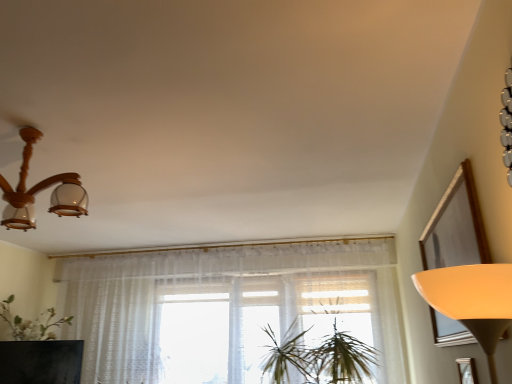
Locate an element on the screen. The width and height of the screenshot is (512, 384). wooden picture frame at lower right is located at coordinates (467, 370).

The height and width of the screenshot is (384, 512). What are the coordinates of `wooden chandelier at upper left` in the screenshot? It's located at (40, 190).

What do you see at coordinates (226, 308) in the screenshot? I see `sheer white curtain at center` at bounding box center [226, 308].

Describe the element at coordinates (41, 362) in the screenshot. The width and height of the screenshot is (512, 384). I see `matte black tv at lower left` at that location.

Identify the location of wooden picture frame at lower right. (467, 370).

Who is shorter, matte black tv at lower left or sheer white curtain at center?

matte black tv at lower left.

From the image's perspective, who appears lower, matte black tv at lower left or sheer white curtain at center?

matte black tv at lower left appears lower in the image.

From a real-world perspective, which object stands above the other?

sheer white curtain at center, from a real-world perspective.

In the scene shown: Looking at the image, does matte black tv at lower left seem bigger or smaller compared to sheer white curtain at center?

Clearly, matte black tv at lower left is smaller in size than sheer white curtain at center.

Is green leafy plant at center facing towards wooden chandelier at upper left?

No, green leafy plant at center is not facing towards wooden chandelier at upper left.

Is green leafy plant at center smaller than wooden chandelier at upper left?

Actually, green leafy plant at center might be larger than wooden chandelier at upper left.

Between green leafy plant at center and wooden chandelier at upper left, which one is positioned in front?

wooden chandelier at upper left is closer to the camera.

Image resolution: width=512 pixels, height=384 pixels. There is a green leafy plant at center. What are the coordinates of `curtain above it (from a real-world perspective)` in the screenshot? It's located at (226, 308).

Is green leafy plant at center positioned far away from sheer white curtain at center?

No.

From the image's perspective, is green leafy plant at center on sheer white curtain at center?

Indeed, from the image's perspective, green leafy plant at center is shown above sheer white curtain at center.

Can you confirm if green leafy plant at center is wider than sheer white curtain at center?

Yes, green leafy plant at center is wider than sheer white curtain at center.

Could matte black tv at lower left be considered to be inside wooden chandelier at upper left?

No, wooden chandelier at upper left does not contain matte black tv at lower left.

Which is in front, wooden chandelier at upper left or matte black tv at lower left?

Positioned in front is wooden chandelier at upper left.

Is sheer white curtain at center looking in the opposite direction of wooden chandelier at upper left?

No.

Is sheer white curtain at center placed right next to wooden chandelier at upper left?

No, sheer white curtain at center is not beside wooden chandelier at upper left.

From the picture: Is sheer white curtain at center not inside wooden chandelier at upper left?

sheer white curtain at center is positioned outside wooden chandelier at upper left.

Which of these two, sheer white curtain at center or wooden chandelier at upper left, is smaller?

wooden chandelier at upper left.

From the picture: Is wooden chandelier at upper left with green leafy plant at center?

No, wooden chandelier at upper left is not with green leafy plant at center.

From a real-world perspective, which is physically below, wooden chandelier at upper left or green leafy plant at center?

In real-world perspective, green leafy plant at center is lower.

Considering the sizes of objects wooden chandelier at upper left and green leafy plant at center in the image provided, who is bigger, wooden chandelier at upper left or green leafy plant at center?

With larger size is green leafy plant at center.

Is the position of wooden chandelier at upper left less distant than that of green leafy plant at center?

Yes.

Considering the relative positions of wooden picture frame at lower right and wooden chandelier at upper left in the image provided, is wooden picture frame at lower right in front of wooden chandelier at upper left?

No, wooden picture frame at lower right is behind wooden chandelier at upper left.

Could you tell me if wooden picture frame at lower right is facing wooden chandelier at upper left?

Yes, wooden picture frame at lower right is facing wooden chandelier at upper left.

From the image's perspective, is wooden picture frame at lower right above wooden chandelier at upper left?

No, from the image's perspective, wooden picture frame at lower right is not above wooden chandelier at upper left.

Looking at this image, is wooden picture frame at lower right bigger than wooden chandelier at upper left?

No, wooden picture frame at lower right is not bigger than wooden chandelier at upper left.

Find the location of `curtain above the matte black tv at lower left (from the image's perspective)`. curtain above the matte black tv at lower left (from the image's perspective) is located at coordinates (226, 308).

Where is `houseplant lying on the right of wooden chandelier at upper left`? houseplant lying on the right of wooden chandelier at upper left is located at coordinates (319, 356).

Looking at the image, which one is located closer to sheer white curtain at center, green leafy plant at center or wooden picture frame at lower right?

green leafy plant at center.

When comparing their distances from wooden picture frame at lower right, does matte black tv at lower left or sheer white curtain at center seem further?

matte black tv at lower left is positioned further to the anchor wooden picture frame at lower right.

When comparing their distances from green leafy plant at center, does matte black tv at lower left or sheer white curtain at center seem further?

matte black tv at lower left lies further to green leafy plant at center than the other object.

Estimate the real-world distances between objects in this image. Which object is closer to sheer white curtain at center, wooden chandelier at upper left or matte black tv at lower left?

matte black tv at lower left.

Considering their positions, is green leafy plant at center positioned further to wooden chandelier at upper left than wooden picture frame at lower right?

green leafy plant at center is positioned further to the anchor wooden chandelier at upper left.

From the image, which object appears to be nearer to wooden picture frame at lower right, wooden chandelier at upper left or matte black tv at lower left?

wooden chandelier at upper left is closer to wooden picture frame at lower right.

When comparing their distances from wooden chandelier at upper left, does matte black tv at lower left or wooden picture frame at lower right seem further?

Among the two, wooden picture frame at lower right is located further to wooden chandelier at upper left.

Looking at the image, which one is located closer to wooden chandelier at upper left, wooden picture frame at lower right or green leafy plant at center?

wooden picture frame at lower right is positioned closer to the anchor wooden chandelier at upper left.

Find the location of `curtain between wooden chandelier at upper left and matte black tv at lower left along the z-axis`. curtain between wooden chandelier at upper left and matte black tv at lower left along the z-axis is located at coordinates (226, 308).

At what (x,y) coordinates should I click in order to perform the action: click on curtain situated between matte black tv at lower left and green leafy plant at center from left to right. Please return your answer as a coordinate pair (x, y). The image size is (512, 384). Looking at the image, I should click on (226, 308).

Identify the location of curtain between matte black tv at lower left and wooden picture frame at lower right in the horizontal direction. The width and height of the screenshot is (512, 384). (226, 308).

Where is `picture frame between wooden chandelier at upper left and sheer white curtain at center from front to back`? The image size is (512, 384). picture frame between wooden chandelier at upper left and sheer white curtain at center from front to back is located at coordinates (467, 370).